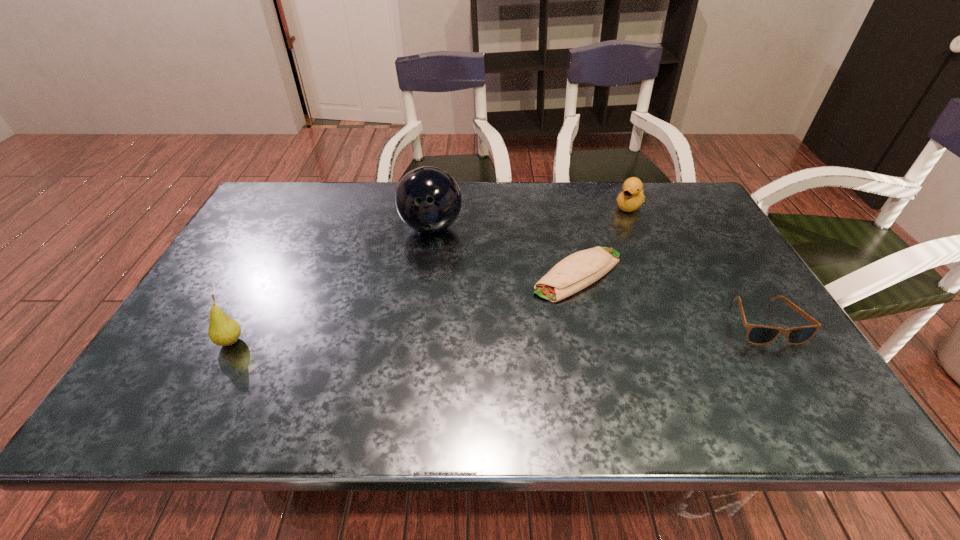
Find the location of a particular element. the second tallest object is located at coordinates (223, 331).

Identify the location of the leftmost object. Image resolution: width=960 pixels, height=540 pixels. (223, 331).

At what (x,y) coordinates should I click in order to perform the action: click on the rightmost object. Please return your answer as a coordinate pair (x, y). Image resolution: width=960 pixels, height=540 pixels. Looking at the image, I should click on (756, 334).

I want to click on sunglasses, so click(x=756, y=334).

Find the location of `the tallest object`. the tallest object is located at coordinates (428, 199).

In order to click on the fourth object from right to left in this screenshot , I will do `click(428, 199)`.

Find the location of `duckling`. duckling is located at coordinates (632, 197).

Image resolution: width=960 pixels, height=540 pixels. Find the location of `the fourth object from left to right`. the fourth object from left to right is located at coordinates (632, 197).

Find the location of a particular element. The image size is (960, 540). the shortest object is located at coordinates (579, 270).

Where is `the third object from left to right`? The height and width of the screenshot is (540, 960). the third object from left to right is located at coordinates (579, 270).